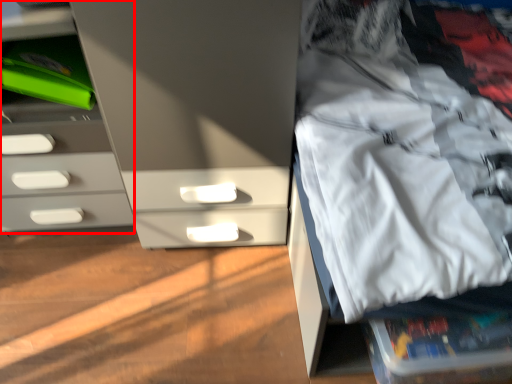
Question: From the image's perspective, where is chest of drawers (annotated by the red box) located in relation to clothing in the image?

Choices:
 (A) above
 (B) below

Answer: (A)